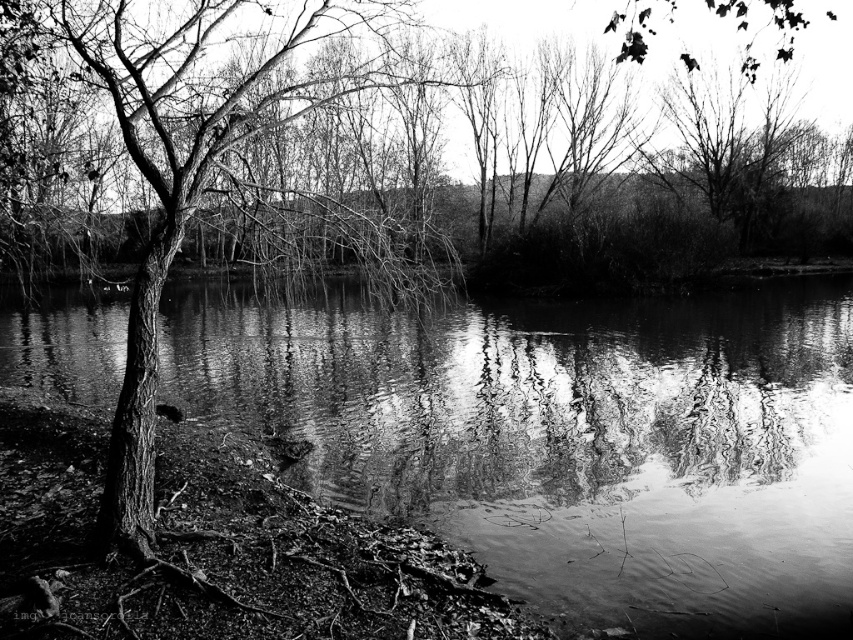
Is smooth water at center wider than smooth bark tree at left?

Correct, the width of smooth water at center exceeds that of smooth bark tree at left.

Who is positioned more to the right, smooth water at center or smooth bark tree at left?

smooth water at center is more to the right.

Describe the element at coordinates (566, 438) in the screenshot. I see `smooth water at center` at that location.

The height and width of the screenshot is (640, 853). I want to click on smooth water at center, so click(566, 438).